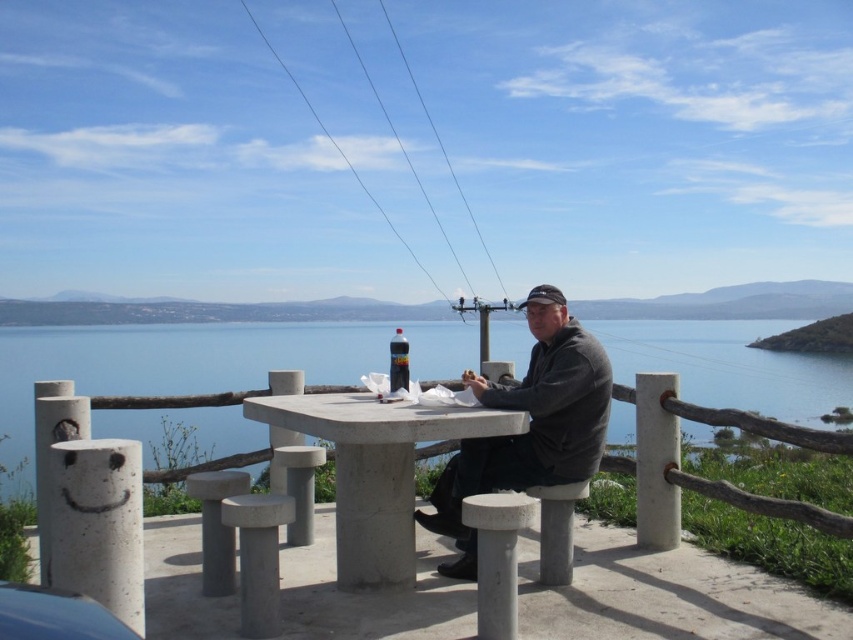
You are a person sitting at the picnic table and want to place your soda bottle on the table. The blue water at table center is in the way. Can you move the soda bottle to the white concrete stool at lower center without moving the blue water?

The white concrete stool at lower center is behind the blue water at table center, so you can move the soda bottle to the white concrete stool at lower center by going around the blue water at table center.